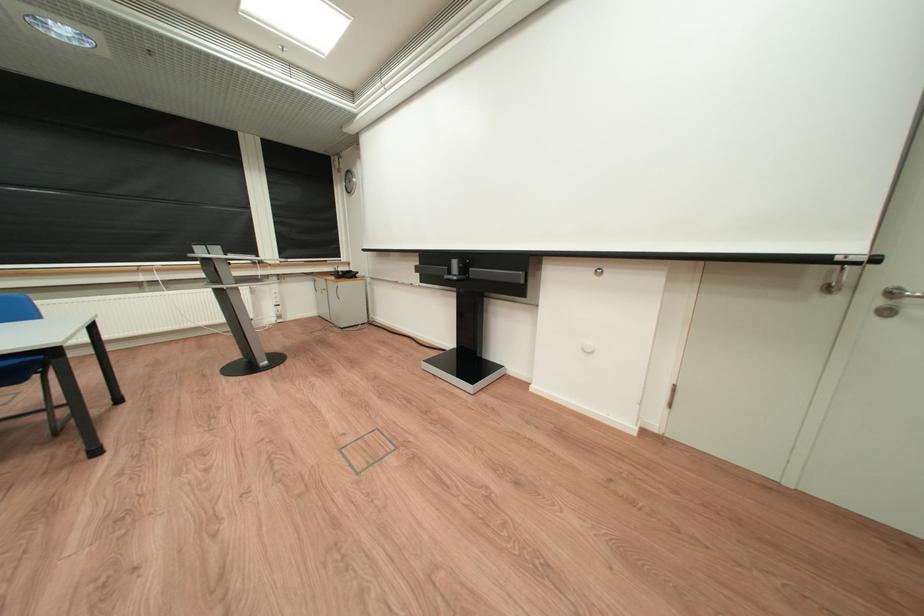
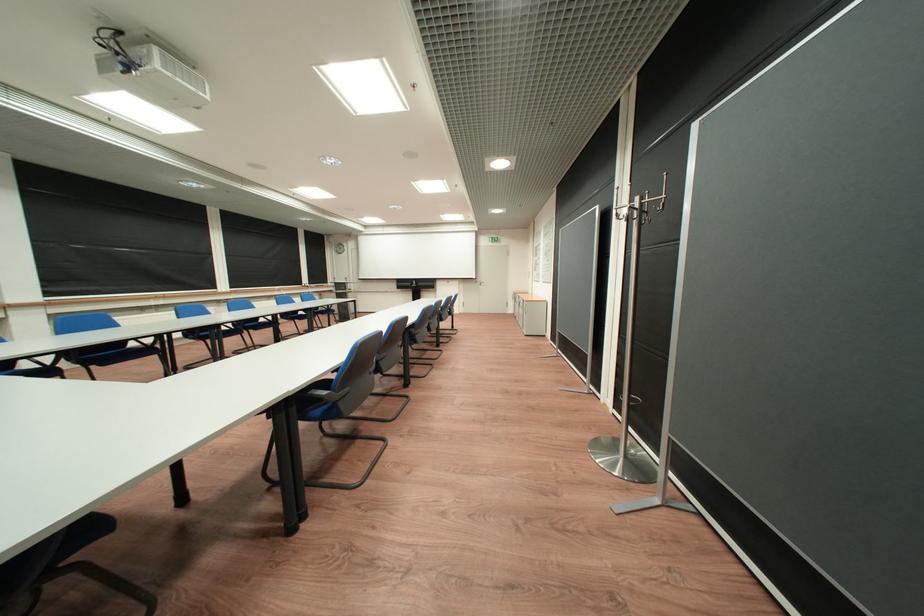
Where in the second image is the point corresponding to the point at 862,249 from the first image?

(487, 278)